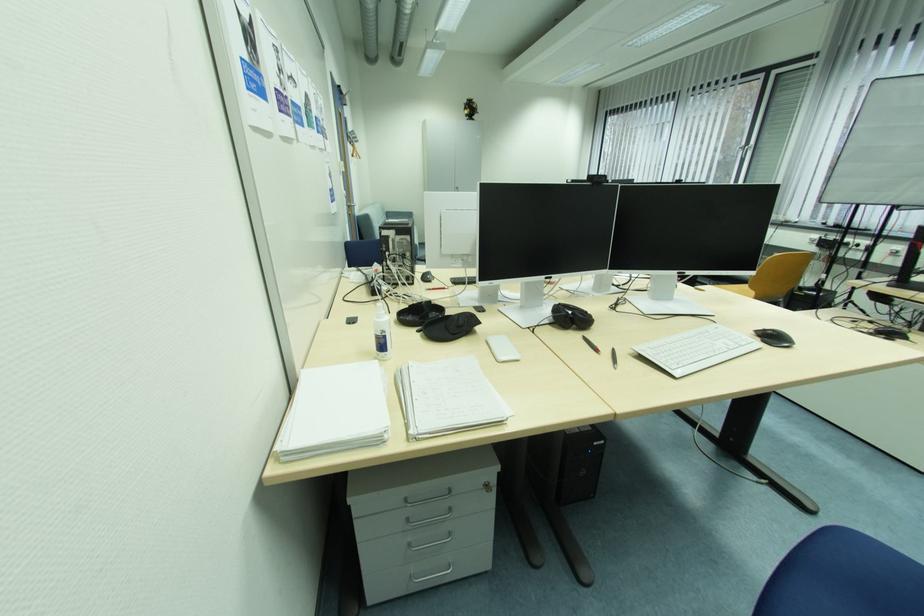
Where is `yellow chair sitting surface`? The width and height of the screenshot is (924, 616). yellow chair sitting surface is located at coordinates (734, 284).